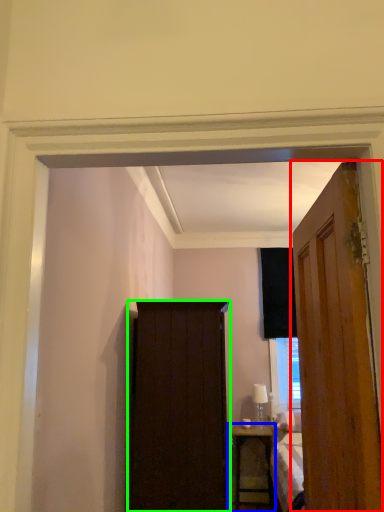
Question: Which is nearer to the door (highlighted by a red box)? nightstand (highlighted by a blue box) or screen door (highlighted by a green box).

Choices:
 (A) nightstand
 (B) screen door

Answer: (B)